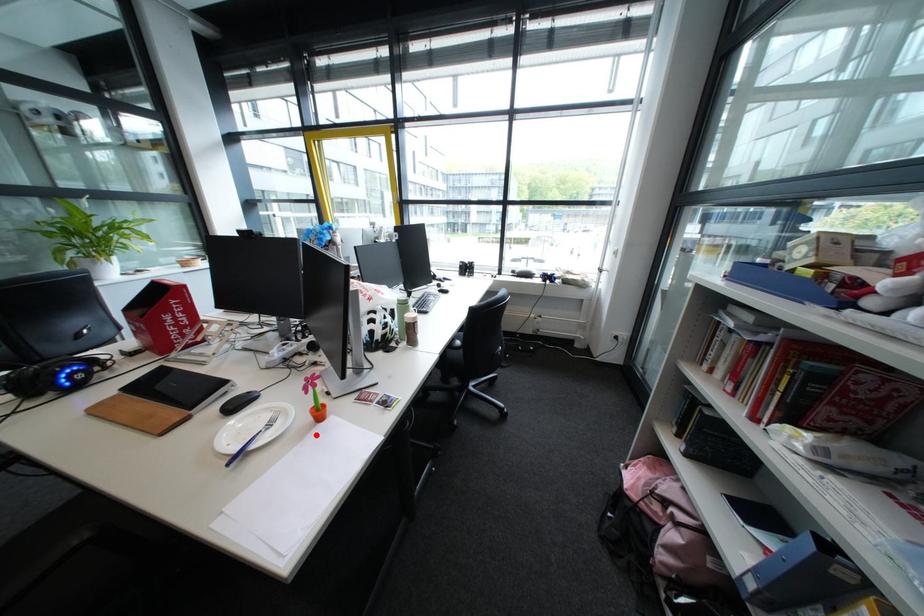
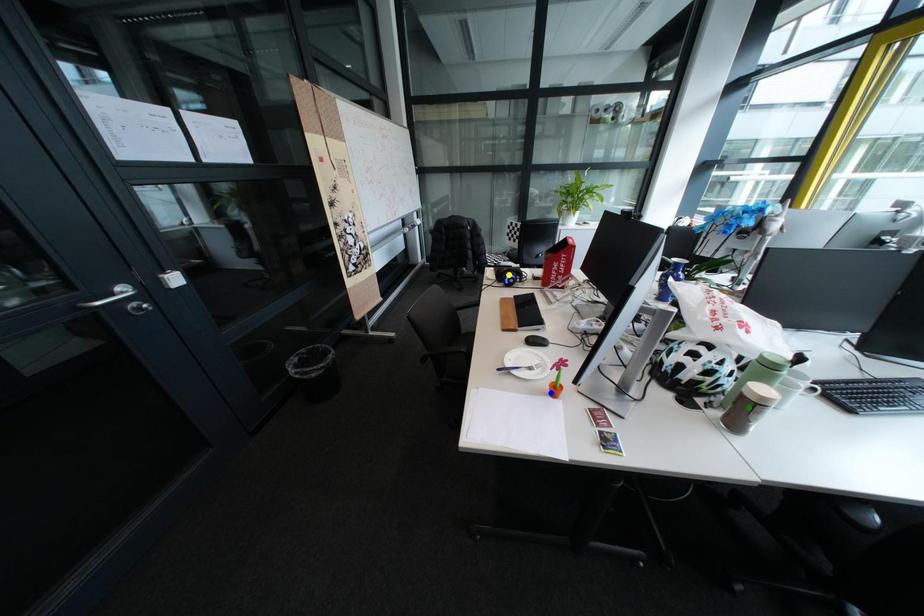
Question: I am providing you with two images of the same scene from different viewpoints. A red point is marked on the first image. You are given multiple points on the second image. In image 2, which mark is for the same physical point as the one in image 1?

Choices:
 (A) green point
 (B) yellow point
 (C) blue point

Answer: (C)